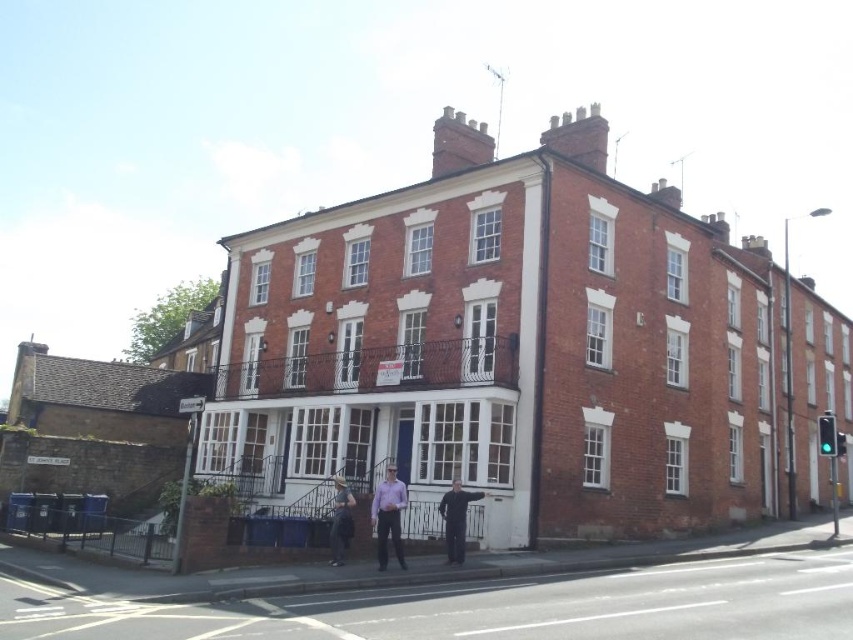
Who is positioned more to the right, purple cotton shirt at center or dark blue jeans at center?

From the viewer's perspective, purple cotton shirt at center appears more on the right side.

Can you confirm if purple cotton shirt at center is thinner than dark blue jeans at center?

Indeed, purple cotton shirt at center has a lesser width compared to dark blue jeans at center.

The height and width of the screenshot is (640, 853). Describe the element at coordinates (387, 516) in the screenshot. I see `purple cotton shirt at center` at that location.

Image resolution: width=853 pixels, height=640 pixels. Find the location of `purple cotton shirt at center`. purple cotton shirt at center is located at coordinates (387, 516).

Is black matte suit at center bigger than dark blue jeans at center?

No.

Does black matte suit at center have a greater height compared to dark blue jeans at center?

In fact, black matte suit at center may be shorter than dark blue jeans at center.

Locate an element on the screen. black matte suit at center is located at coordinates (456, 518).

Identify the location of black matte suit at center. The image size is (853, 640). (456, 518).

Between point (370, 509) and point (445, 538), which one is positioned in front?

Point (445, 538) is more forward.

Which is more to the right, purple cotton shirt at center or black matte suit at center?

black matte suit at center is more to the right.

The width and height of the screenshot is (853, 640). I want to click on purple cotton shirt at center, so click(387, 516).